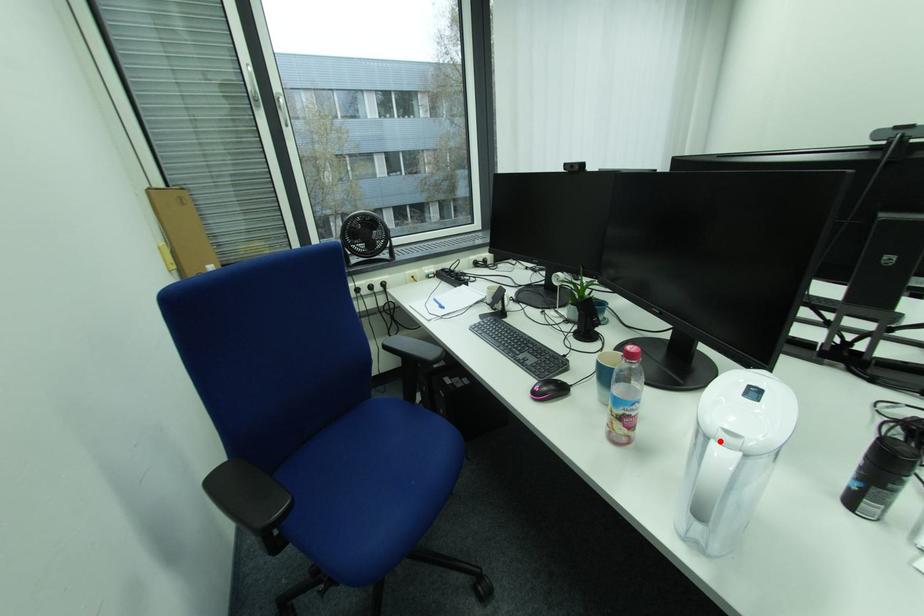
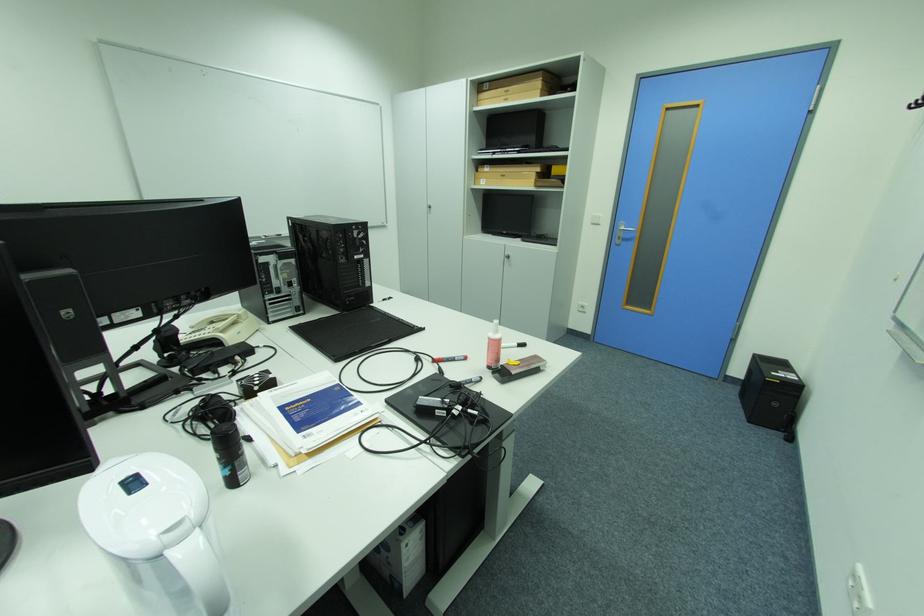
In the second image, find the point that corresponds to the highlighted location in the first image.

(175, 554)